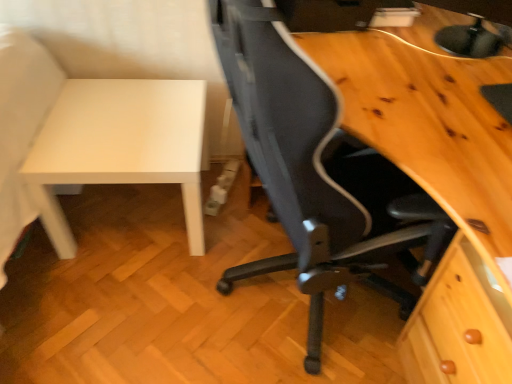
Question: Does white matte table at left have a larger size compared to matte black monitor at upper right?

Choices:
 (A) yes
 (B) no

Answer: (A)

Question: Is matte black monitor at upper right inside white matte table at left?

Choices:
 (A) no
 (B) yes

Answer: (A)

Question: Could you tell me if white matte table at left is facing matte black monitor at upper right?

Choices:
 (A) yes
 (B) no

Answer: (B)

Question: From a real-world perspective, is white matte table at left located higher than matte black monitor at upper right?

Choices:
 (A) yes
 (B) no

Answer: (B)

Question: Is white matte table at left behind matte black monitor at upper right?

Choices:
 (A) no
 (B) yes

Answer: (B)

Question: From a real-world perspective, is white matte table at left above or below black mesh chair at center?

Choices:
 (A) below
 (B) above

Answer: (A)

Question: Considering the positions of white matte table at left and black mesh chair at center in the image, is white matte table at left wider or thinner than black mesh chair at center?

Choices:
 (A) thin
 (B) wide

Answer: (A)

Question: Is point (56, 120) positioned closer to the camera than point (385, 180)?

Choices:
 (A) closer
 (B) farther

Answer: (B)

Question: From the image's perspective, is white matte table at left positioned above or below black mesh chair at center?

Choices:
 (A) above
 (B) below

Answer: (A)

Question: Choose the correct answer: Is black mesh chair at center inside matte black monitor at upper right or outside it?

Choices:
 (A) outside
 (B) inside

Answer: (A)

Question: From a real-world perspective, is black mesh chair at center positioned above or below matte black monitor at upper right?

Choices:
 (A) above
 (B) below

Answer: (B)

Question: Would you say black mesh chair at center is to the left or to the right of matte black monitor at upper right in the picture?

Choices:
 (A) left
 (B) right

Answer: (A)

Question: From their relative heights in the image, would you say black mesh chair at center is taller or shorter than matte black monitor at upper right?

Choices:
 (A) tall
 (B) short

Answer: (A)

Question: In terms of height, does matte black monitor at upper right look taller or shorter compared to white matte table at left?

Choices:
 (A) tall
 (B) short

Answer: (B)

Question: Considering their positions, is matte black monitor at upper right located in front of or behind white matte table at left?

Choices:
 (A) front
 (B) behind

Answer: (A)